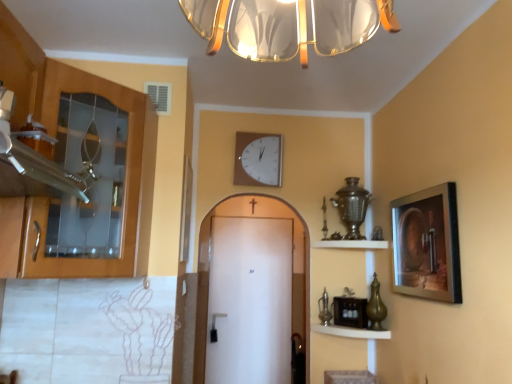
Question: Is white plastic wall clock at upper center further to camera compared to white matte door at center?

Choices:
 (A) yes
 (B) no

Answer: (B)

Question: Could you tell me if white plastic wall clock at upper center is turned towards white matte door at center?

Choices:
 (A) no
 (B) yes

Answer: (A)

Question: Is white plastic wall clock at upper center thinner than white matte door at center?

Choices:
 (A) yes
 (B) no

Answer: (A)

Question: From a real-world perspective, is white plastic wall clock at upper center over white matte door at center?

Choices:
 (A) yes
 (B) no

Answer: (A)

Question: Does white plastic wall clock at upper center have a lesser height compared to white matte door at center?

Choices:
 (A) no
 (B) yes

Answer: (B)

Question: Is white plastic wall clock at upper center facing away from white matte door at center?

Choices:
 (A) no
 (B) yes

Answer: (A)

Question: Is wooden cabinet at left far from white matte door at center?

Choices:
 (A) no
 (B) yes

Answer: (B)

Question: Is wooden cabinet at left further to camera compared to white matte door at center?

Choices:
 (A) yes
 (B) no

Answer: (B)

Question: Considering the relative sizes of wooden cabinet at left and white matte door at center in the image provided, is wooden cabinet at left taller than white matte door at center?

Choices:
 (A) yes
 (B) no

Answer: (B)

Question: From a real-world perspective, is wooden cabinet at left positioned under white matte door at center based on gravity?

Choices:
 (A) no
 (B) yes

Answer: (A)

Question: Could you tell me if wooden cabinet at left is turned towards white matte door at center?

Choices:
 (A) no
 (B) yes

Answer: (A)

Question: Can you confirm if wooden cabinet at left is thinner than white matte door at center?

Choices:
 (A) yes
 (B) no

Answer: (B)

Question: Is white matte door at center turned away from metallic gold shelf at upper center, the 2th shelf when ordered from bottom to top?

Choices:
 (A) yes
 (B) no

Answer: (B)